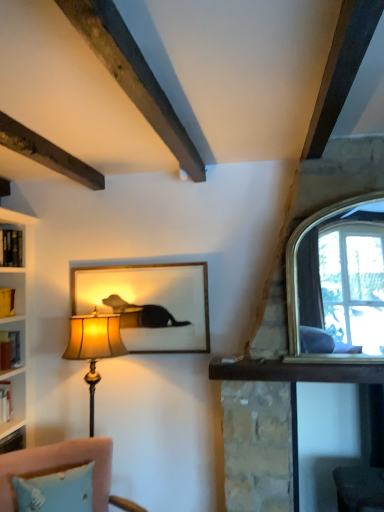
Question: Considering their positions, is matte glass picture frame at center located in front of or behind velvet pink sofa at lower left?

Choices:
 (A) front
 (B) behind

Answer: (B)

Question: In terms of height, does matte glass picture frame at center look taller or shorter compared to velvet pink sofa at lower left?

Choices:
 (A) tall
 (B) short

Answer: (A)

Question: Which object is positioned closest to the matte gold lampshade at left?

Choices:
 (A) velvet pink sofa at lower left
 (B) clear glass window at upper right
 (C) matte glass picture frame at center
 (D) hardcover book at left

Answer: (C)

Question: Based on their relative distances, which object is nearer to the velvet pink sofa at lower left?

Choices:
 (A) matte glass picture frame at center
 (B) matte gold lampshade at left
 (C) clear glass window at upper right
 (D) hardcover book at left

Answer: (B)